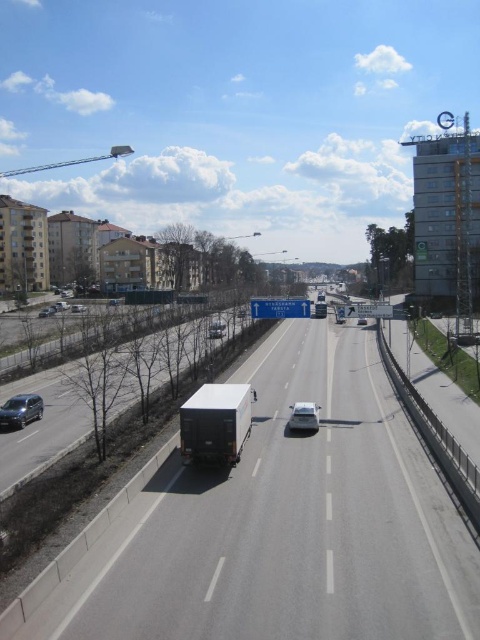
You are a delivery driver needing to park your vehicle between the shiny silver sedan at center and the silver metallic sedan at lower left. Your truck is 2 meters wide. Can you fit your truck between them?

The shiny silver sedan at center is thinner than the silver metallic sedan at lower left, but the exact distance between them isn not provided. Without knowing the space between the two sedans, it is impossible to determine if the truck can fit.

From the picture: You are a delivery driver planning to turn left onto a side street that is 100 meters ahead from your current position. There is a white matte truck at left. Will the truck block your view of the upcoming turn?

The white matte truck at left is located at point (294, 522), which is closer to the turn than your current position. This means the truck will likely block your view of the upcoming turn, making it difficult to see oncoming traffic or obstacles ahead. Proceed with caution or wait until the truck moves forward.

You are a delivery driver needing to park your shiny silver sedan at center in a designated parking spot located at coordinates 0.652, 0.633. Is your current position already aligned with the parking spot?

The shiny silver sedan at center is located at point (303, 417), so yes, it is already aligned with the parking spot at those coordinates.